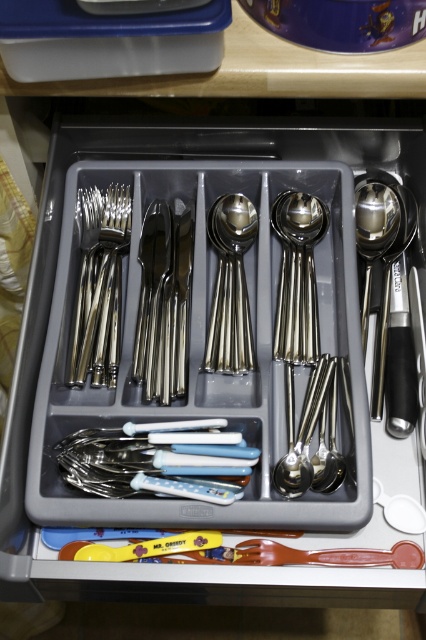
Which of these two, white plastic forks at center or satin silver spoon at center, stands taller?

Standing taller between the two is satin silver spoon at center.

Who is more distant from viewer, [195,480] or [238,248]?

Point [238,248]

Who is more distant from viewer, (226, 451) or (218, 312)?

Positioned behind is point (218, 312).

Locate an element on the screen. This screenshot has height=640, width=426. white plastic forks at center is located at coordinates (158, 460).

Describe the element at coordinates (100, 285) in the screenshot. Image resolution: width=426 pixels, height=640 pixels. I see `satin silver forks at left` at that location.

Which is in front, point (89, 268) or point (368, 285)?

Positioned in front is point (368, 285).

Who is more forward, (120, 192) or (386, 202)?

Point (386, 202)

At what (x,y) coordinates should I click in order to perform the action: click on satin silver forks at left. Please return your answer as a coordinate pair (x, y). This screenshot has height=640, width=426. Looking at the image, I should click on (100, 285).

Does satin silver forks at left appear on the left side of satin silver spoon at center?

Correct, you'll find satin silver forks at left to the left of satin silver spoon at center.

Describe the element at coordinates (100, 285) in the screenshot. I see `satin silver forks at left` at that location.

In order to click on satin silver forks at left in this screenshot , I will do `click(100, 285)`.